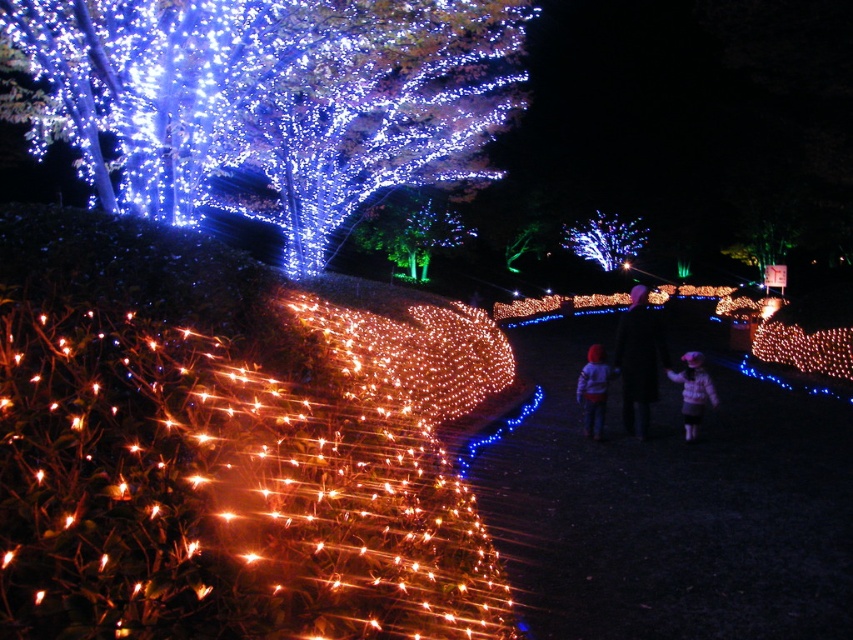
Does illuminated plastic tree at upper left have a lesser height compared to black fabric at center?

In fact, illuminated plastic tree at upper left may be taller than black fabric at center.

Locate an element on the screen. illuminated plastic tree at upper left is located at coordinates (271, 99).

Is black fabric at center taller than fluffy pink coat at center?

Indeed, black fabric at center has a greater height compared to fluffy pink coat at center.

Can you confirm if black fabric at center is positioned to the right of fluffy pink coat at center?

Yes, black fabric at center is to the right of fluffy pink coat at center.

Is point (657, 371) positioned behind point (695, 381)?

Yes.

Locate an element on the screen. Image resolution: width=853 pixels, height=640 pixels. black fabric at center is located at coordinates (639, 360).

Does warm golden lights at lower left appear on the left side of black fabric at center?

Yes, warm golden lights at lower left is to the left of black fabric at center.

Can you confirm if warm golden lights at lower left is smaller than black fabric at center?

Yes, warm golden lights at lower left is smaller than black fabric at center.

At what (x,y) coordinates should I click in order to perform the action: click on warm golden lights at lower left. Please return your answer as a coordinate pair (x, y). This screenshot has width=853, height=640. Looking at the image, I should click on (219, 499).

Where is `warm golden lights at lower left`? This screenshot has width=853, height=640. warm golden lights at lower left is located at coordinates (219, 499).